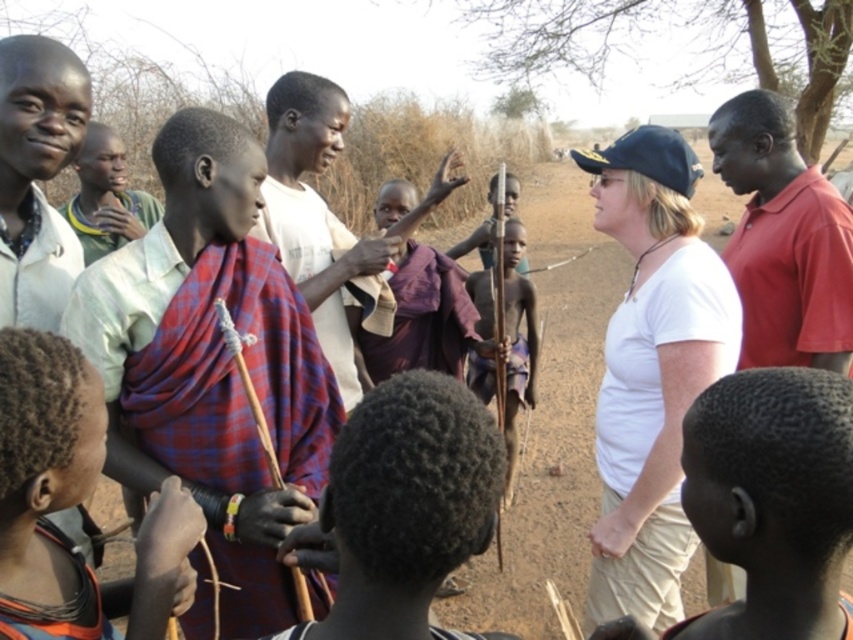
Which of these two, red plaid cloth at center or red plaid shawl at center, stands shorter?

red plaid shawl at center

Is red plaid cloth at center wider than red plaid shawl at center?

Correct, the width of red plaid cloth at center exceeds that of red plaid shawl at center.

Who is more distant from viewer, (280, 93) or (90, 204)?

Point (90, 204)

At what (x,y) coordinates should I click in order to perform the action: click on red plaid cloth at center. Please return your answer as a coordinate pair (x, y). Image resolution: width=853 pixels, height=640 pixels. Looking at the image, I should click on (328, 224).

I want to click on red smooth shirt at right, so click(x=782, y=240).

Between red smooth shirt at right and matte white shirt at left, which one is positioned higher?

red smooth shirt at right

Find the location of a particular element. The width and height of the screenshot is (853, 640). red smooth shirt at right is located at coordinates (782, 240).

Consider the image. Does plaid fabric scarf at center have a greater height compared to red plaid cloth at center?

No.

Is plaid fabric scarf at center further to the viewer compared to red plaid cloth at center?

No, plaid fabric scarf at center is in front of red plaid cloth at center.

This screenshot has width=853, height=640. What do you see at coordinates (45, 470) in the screenshot? I see `plaid fabric scarf at center` at bounding box center [45, 470].

What are the coordinates of `plaid fabric scarf at center` in the screenshot? It's located at (x=45, y=470).